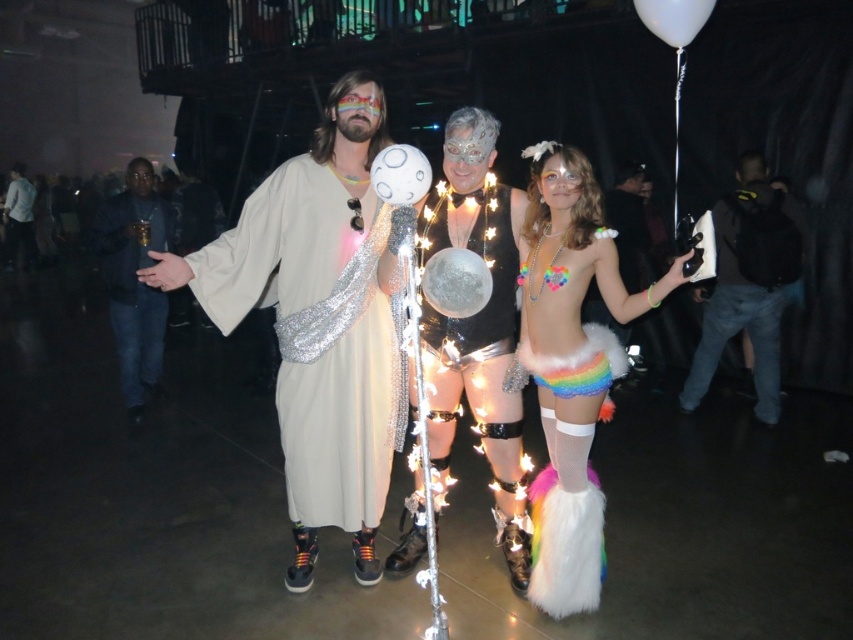
Question: Does black satin suit at left have a smaller size compared to white glossy balloon at center?

Choices:
 (A) no
 (B) yes

Answer: (A)

Question: Which object appears farthest from the camera in this image?

Choices:
 (A) glittery metallic ball at center
 (B) black satin suit at left
 (C) white sequined robe at center
 (D) rainbow fabric bikini at center

Answer: (B)

Question: Observing the image, what is the correct spatial positioning of white glossy balloon at center in reference to white matte robe at center?

Choices:
 (A) above
 (B) below

Answer: (B)

Question: Which point is farther to the camera?

Choices:
 (A) rainbow fabric bikini at center
 (B) rainbow sequined bikini at center

Answer: (A)

Question: Is rainbow fabric bikini at center positioned before white glossy balloon at center?

Choices:
 (A) yes
 (B) no

Answer: (B)

Question: Which is farther from the rainbow sequin bikini top at center?

Choices:
 (A) white matte robe at center
 (B) white glossy balloon at upper right

Answer: (A)